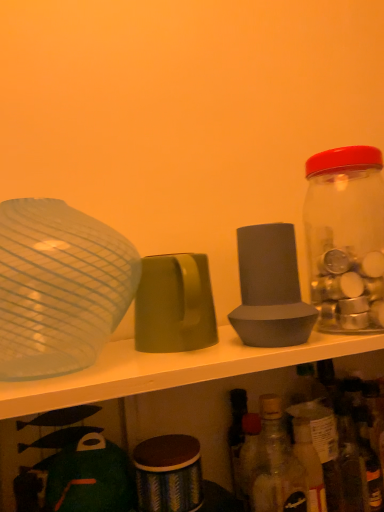
Question: Is matte green cup at center, the 2th tableware viewed from the left, positioned behind translucent glass bottle at lower right, which ranks as the 2th bottle in top-to-bottom order?

Choices:
 (A) yes
 (B) no

Answer: (B)

Question: From the image's perspective, is matte green cup at center, the 2th tableware positioned from the right, below translucent glass bottle at lower right, which is the first bottle from left to right?

Choices:
 (A) yes
 (B) no

Answer: (B)

Question: Is matte green cup at center, the 2th tableware viewed from the left, oriented towards translucent glass bottle at lower right, the second bottle from the right?

Choices:
 (A) yes
 (B) no

Answer: (B)

Question: Is matte green cup at center, the 2th tableware viewed from the left, smaller than translucent glass bottle at lower right, acting as the 1th bottle starting from the bottom?

Choices:
 (A) no
 (B) yes

Answer: (B)

Question: Does matte green cup at center, the 2th tableware viewed from the left, have a lesser width compared to translucent glass bottle at lower right, which ranks as the 2th bottle in top-to-bottom order?

Choices:
 (A) no
 (B) yes

Answer: (A)

Question: Considering the positions of gray matte speaker at center, the 1th tableware in the right-to-left sequence, and transparent glass jar at right, the 1th bottle from the right, in the image, is gray matte speaker at center, the 1th tableware in the right-to-left sequence, bigger or smaller than transparent glass jar at right, the 1th bottle from the right,?

Choices:
 (A) big
 (B) small

Answer: (B)

Question: From a real-world perspective, is gray matte speaker at center, the 1th tableware in the right-to-left sequence, above or below transparent glass jar at right, placed as the 1th bottle when sorted from top to bottom?

Choices:
 (A) below
 (B) above

Answer: (A)

Question: Is gray matte speaker at center, the 1th tableware in the right-to-left sequence, wider or thinner than transparent glass jar at right, the 1th bottle from the right?

Choices:
 (A) wide
 (B) thin

Answer: (B)

Question: In the image, is gray matte speaker at center, the 1th tableware in the right-to-left sequence, positioned in front of or behind transparent glass jar at right, which ranks as the 2th bottle in bottom-to-top order?

Choices:
 (A) front
 (B) behind

Answer: (A)

Question: In the image, is transparent glass bowl at left, which is the 3th tableware from right to left, positioned in front of or behind gray matte speaker at center, which ranks as the 3th tableware in left-to-right order?

Choices:
 (A) front
 (B) behind

Answer: (A)

Question: In the image, is transparent glass bowl at left, which is the 3th tableware from right to left, on the left side or the right side of gray matte speaker at center, the 1th tableware in the right-to-left sequence?

Choices:
 (A) right
 (B) left

Answer: (B)

Question: From the image's perspective, is transparent glass bowl at left, which is the 1th tableware from left to right, positioned above or below gray matte speaker at center, which ranks as the 3th tableware in left-to-right order?

Choices:
 (A) below
 (B) above

Answer: (A)

Question: In terms of height, does transparent glass bowl at left, which is the 1th tableware from left to right, look taller or shorter compared to gray matte speaker at center, which ranks as the 3th tableware in left-to-right order?

Choices:
 (A) short
 (B) tall

Answer: (B)

Question: Based on their positions, is gray matte speaker at center, the 1th tableware in the right-to-left sequence, located to the left or right of translucent glass bottle at lower right, acting as the 1th bottle starting from the bottom?

Choices:
 (A) right
 (B) left

Answer: (B)

Question: Is point (283, 295) closer or farther from the camera than point (284, 509)?

Choices:
 (A) closer
 (B) farther

Answer: (A)